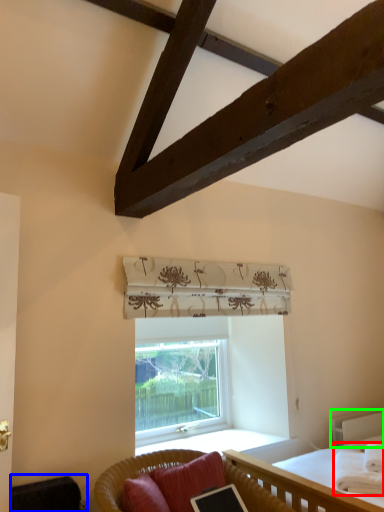
Question: Which object is the farthest from blanket (highlighted by a red box)? Choose among these: swivel chair (highlighted by a blue box) or balustrade (highlighted by a green box).

Choices:
 (A) swivel chair
 (B) balustrade

Answer: (A)